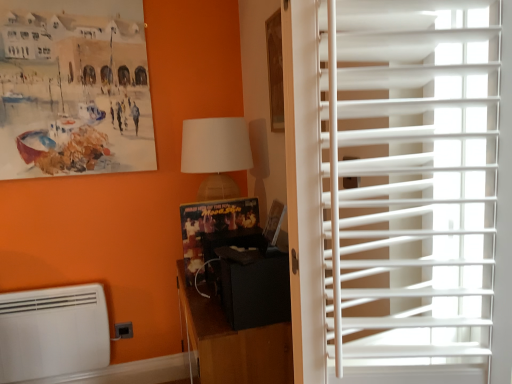
In order to face black matte cabinet at center, should I rotate leftwards or rightwards?

Turn left by 3.287 degrees to look at black matte cabinet at center.

Find the location of a particular element. The height and width of the screenshot is (384, 512). white plastic blinds at right is located at coordinates (411, 179).

What do you see at coordinates (216, 154) in the screenshot?
I see `matte white lampshade at upper center` at bounding box center [216, 154].

The height and width of the screenshot is (384, 512). In order to click on matte white lampshade at upper center in this screenshot , I will do `click(216, 154)`.

The height and width of the screenshot is (384, 512). What are the coordinates of `white matte air conditioning at lower left` in the screenshot? It's located at (53, 332).

Where is `black matte cabinet at center`? The image size is (512, 384). black matte cabinet at center is located at coordinates (231, 343).

Between white plastic blinds at right and white matte air conditioning at lower left, which one has larger width?

With larger width is white plastic blinds at right.

Considering the positions of point (476, 224) and point (83, 360), is point (476, 224) closer or farther from the camera than point (83, 360)?

Point (476, 224).

Visually, is white plastic blinds at right positioned to the left or to the right of white matte air conditioning at lower left?

In the image, white plastic blinds at right appears on the right side of white matte air conditioning at lower left.

Is white plastic blinds at right positioned with its back to white matte air conditioning at lower left?

No, white plastic blinds at right is not facing away from white matte air conditioning at lower left.

Considering the relative sizes of white plastic blinds at right and black matte cabinet at center in the image provided, is white plastic blinds at right taller than black matte cabinet at center?

Yes.

Considering the positions of point (332, 240) and point (196, 300), is point (332, 240) closer or farther from the camera than point (196, 300)?

Clearly, point (332, 240) is closer to the camera than point (196, 300).

Is white plastic blinds at right at the left side of black matte cabinet at center?

No.

Could you tell me if white plastic blinds at right is turned towards black matte cabinet at center?

No, white plastic blinds at right is not oriented towards black matte cabinet at center.

Where is `window blind lying below the matte white lampshade at upper center (from the image's perspective)`? This screenshot has width=512, height=384. window blind lying below the matte white lampshade at upper center (from the image's perspective) is located at coordinates (411, 179).

Considering the sizes of objects white plastic blinds at right and matte white lampshade at upper center in the image provided, who is shorter, white plastic blinds at right or matte white lampshade at upper center?

matte white lampshade at upper center is shorter.

From a real-world perspective, is white plastic blinds at right beneath matte white lampshade at upper center?

Yes, from a real-world perspective, white plastic blinds at right is beneath matte white lampshade at upper center.

Would you say white plastic blinds at right is a long distance from matte white lampshade at upper center?

A: That's not correct — white plastic blinds at right is a little close to matte white lampshade at upper center.

Between matte white lampshade at upper center and white matte air conditioning at lower left, which one has more height?

white matte air conditioning at lower left is taller.

Is matte white lampshade at upper center facing away from white matte air conditioning at lower left?

No, matte white lampshade at upper center is not facing away from white matte air conditioning at lower left.

From the image's perspective, does matte white lampshade at upper center appear lower than white matte air conditioning at lower left?

No.

Is the surface of matte white lampshade at upper center in direct contact with white matte air conditioning at lower left?

No.

How different are the orientations of white matte air conditioning at lower left and matte white lampshade at upper center in degrees?

The facing directions of white matte air conditioning at lower left and matte white lampshade at upper center are 86.1 degrees apart.

Considering the sizes of white matte air conditioning at lower left and matte white lampshade at upper center in the image, is white matte air conditioning at lower left taller or shorter than matte white lampshade at upper center?

In the image, white matte air conditioning at lower left appears to be taller than matte white lampshade at upper center.

Looking at their sizes, would you say white matte air conditioning at lower left is wider or thinner than matte white lampshade at upper center?

Clearly, white matte air conditioning at lower left has less width compared to matte white lampshade at upper center.

Is white matte air conditioning at lower left far away from matte white lampshade at upper center?

Actually, white matte air conditioning at lower left and matte white lampshade at upper center are a little close together.

Looking at this image, does white matte air conditioning at lower left have a larger size compared to white plastic blinds at right?

No.

From the picture: Is white matte air conditioning at lower left in front of or behind white plastic blinds at right in the image?

Clearly, white matte air conditioning at lower left is behind white plastic blinds at right.

The image size is (512, 384). In order to click on window blind that appears above the white matte air conditioning at lower left (from a real-world perspective) in this screenshot , I will do `click(411, 179)`.

Is black matte cabinet at center to the right of white matte air conditioning at lower left from the viewer's perspective?

Indeed, black matte cabinet at center is positioned on the right side of white matte air conditioning at lower left.

This screenshot has height=384, width=512. I want to click on furniture located on the right of white matte air conditioning at lower left, so click(x=231, y=343).

What's the angular difference between black matte cabinet at center and white matte air conditioning at lower left's facing directions?

There is a 89.6-degree angle between the facing directions of black matte cabinet at center and white matte air conditioning at lower left.

Could you tell me if black matte cabinet at center is facing white matte air conditioning at lower left?

Yes, black matte cabinet at center is oriented towards white matte air conditioning at lower left.

Locate an element on the screen. window blind above the white matte air conditioning at lower left (from the image's perspective) is located at coordinates (411, 179).

I want to click on furniture that appears below the white plastic blinds at right (from the image's perspective), so click(231, 343).

Considering their positions, is black matte cabinet at center positioned closer to matte white lampshade at upper center than white plastic blinds at right?

black matte cabinet at center.

Looking at the image, which one is located further to matte white lampshade at upper center, white matte air conditioning at lower left or white plastic blinds at right?

white plastic blinds at right is positioned further to the anchor matte white lampshade at upper center.

Estimate the real-world distances between objects in this image. Which object is further from white matte air conditioning at lower left, matte white lampshade at upper center or white plastic blinds at right?

white plastic blinds at right.

Considering their positions, is white matte air conditioning at lower left positioned further to matte white lampshade at upper center than black matte cabinet at center?

Among the two, white matte air conditioning at lower left is located further to matte white lampshade at upper center.

Considering their positions, is matte white lampshade at upper center positioned closer to white plastic blinds at right than white matte air conditioning at lower left?

Among the two, matte white lampshade at upper center is located nearer to white plastic blinds at right.

Estimate the real-world distances between objects in this image. Which object is closer to white matte air conditioning at lower left, matte white lampshade at upper center or black matte cabinet at center?

The object closer to white matte air conditioning at lower left is black matte cabinet at center.

From the image, which object appears to be farther from black matte cabinet at center, matte white lampshade at upper center or white matte air conditioning at lower left?

Among the two, white matte air conditioning at lower left is located further to black matte cabinet at center.

Looking at the image, which one is located further to black matte cabinet at center, white matte air conditioning at lower left or white plastic blinds at right?

Among the two, white matte air conditioning at lower left is located further to black matte cabinet at center.

This screenshot has width=512, height=384. I want to click on furniture between white plastic blinds at right and matte white lampshade at upper center along the z-axis, so click(x=231, y=343).

The height and width of the screenshot is (384, 512). What are the coordinates of `lamp located between white matte air conditioning at lower left and black matte cabinet at center in the left-right direction` in the screenshot? It's located at (216, 154).

What are the coordinates of `furniture positioned between white plastic blinds at right and white matte air conditioning at lower left from near to far` in the screenshot? It's located at (231, 343).

Locate an element on the screen. The width and height of the screenshot is (512, 384). lamp positioned between white plastic blinds at right and white matte air conditioning at lower left from near to far is located at coordinates (216, 154).